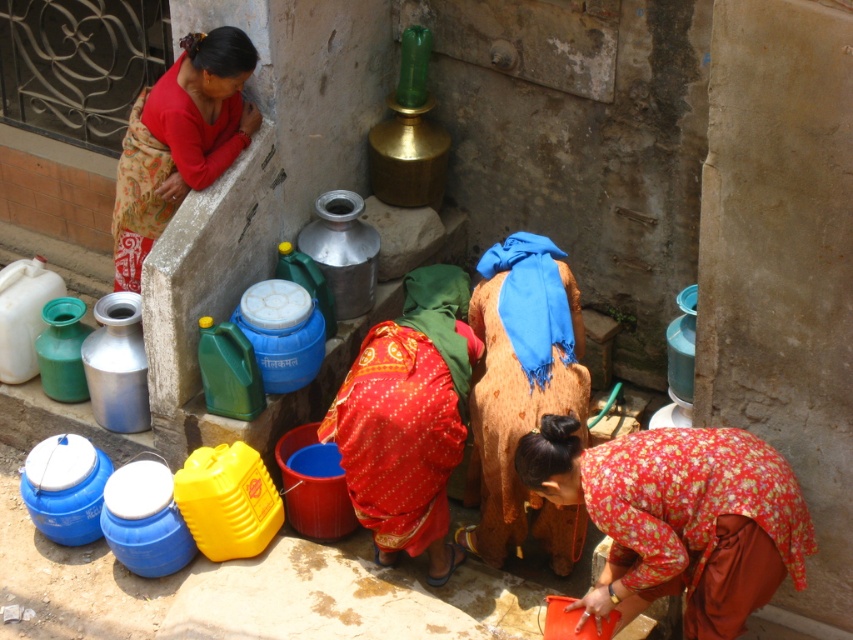
Question: Can you confirm if floral fabric dress at lower center is positioned to the left of red floral dress at center?

Choices:
 (A) no
 (B) yes

Answer: (A)

Question: Where is floral fabric dress at lower center located in relation to red floral dress at center in the image?

Choices:
 (A) below
 (B) above

Answer: (A)

Question: Which object is closer to the camera taking this photo?

Choices:
 (A) matte red fabric at upper left
 (B) red floral dress at center

Answer: (B)

Question: Is floral fabric dress at lower center positioned in front of red floral dress at center?

Choices:
 (A) no
 (B) yes

Answer: (B)

Question: Estimate the real-world distances between objects in this image. Which object is farther from the floral fabric dress at lower center?

Choices:
 (A) red floral dress at center
 (B) matte red fabric at upper left

Answer: (B)

Question: Which point is farther to the camera?

Choices:
 (A) (772, 540)
 (B) (405, 388)

Answer: (B)